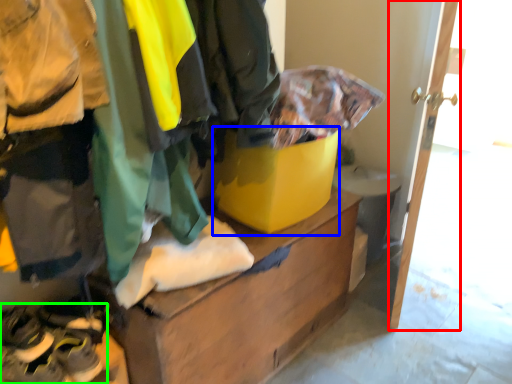
Question: Which object is positioned closest to door (highlighted by a red box)? Select from cardboard box (highlighted by a blue box) and footwear (highlighted by a green box).

Choices:
 (A) cardboard box
 (B) footwear

Answer: (A)